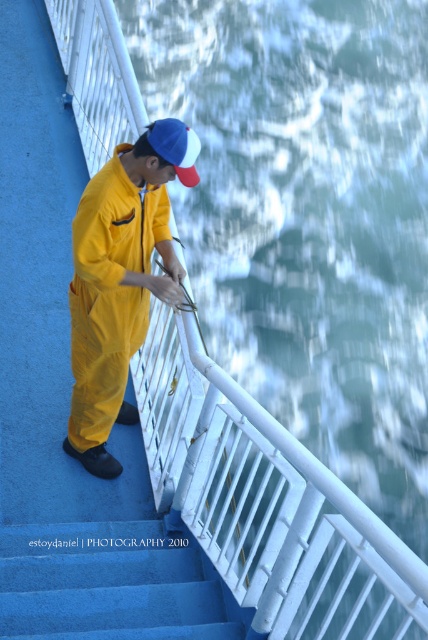
Question: Which point appears farthest from the camera in this image?

Choices:
 (A) (154, 548)
 (B) (186, 157)

Answer: (A)

Question: Which point is farther to the camera?

Choices:
 (A) [89, 291]
 (B) [180, 170]
 (C) [186, 620]

Answer: (A)

Question: Can you confirm if blue carpeted stairs at lower left is positioned below blue fabric cap at upper center?

Choices:
 (A) no
 (B) yes

Answer: (B)

Question: Is blue carpeted stairs at lower left further to camera compared to blue fabric cap at upper center?

Choices:
 (A) no
 (B) yes

Answer: (A)

Question: Does yellow matte jumpsuit at center appear on the left side of blue fabric cap at upper center?

Choices:
 (A) yes
 (B) no

Answer: (A)

Question: Which of the following is the closest to the observer?

Choices:
 (A) (178, 147)
 (B) (50, 611)
 (C) (136, 196)

Answer: (A)